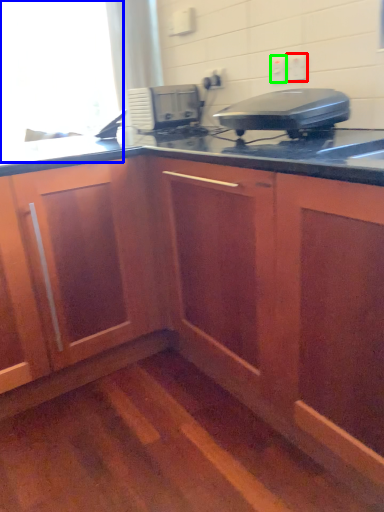
Question: Which object is positioned closest to electric outlet (highlighted by a red box)? Select from window screen (highlighted by a blue box) and electric outlet (highlighted by a green box).

Choices:
 (A) window screen
 (B) electric outlet

Answer: (B)